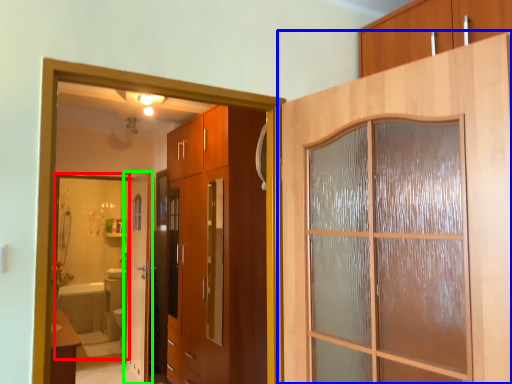
Question: Which is farther away from mirror (highlighted by a red box)? door (highlighted by a blue box) or door (highlighted by a green box)?

Choices:
 (A) door
 (B) door

Answer: (A)